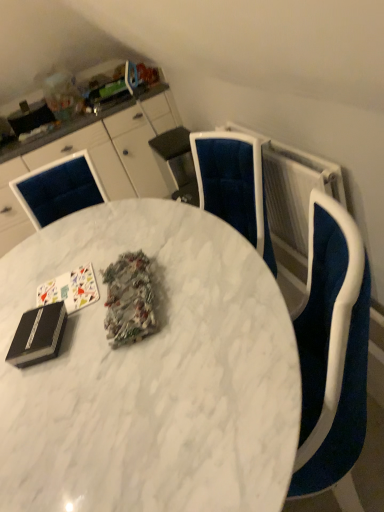
At what (x,y) coordinates should I click in order to perform the action: click on vacant area situated to the left side of white matte card game at upper left. Please return your answer as a coordinate pair (x, y). Image resolution: width=384 pixels, height=512 pixels. Looking at the image, I should click on (15, 306).